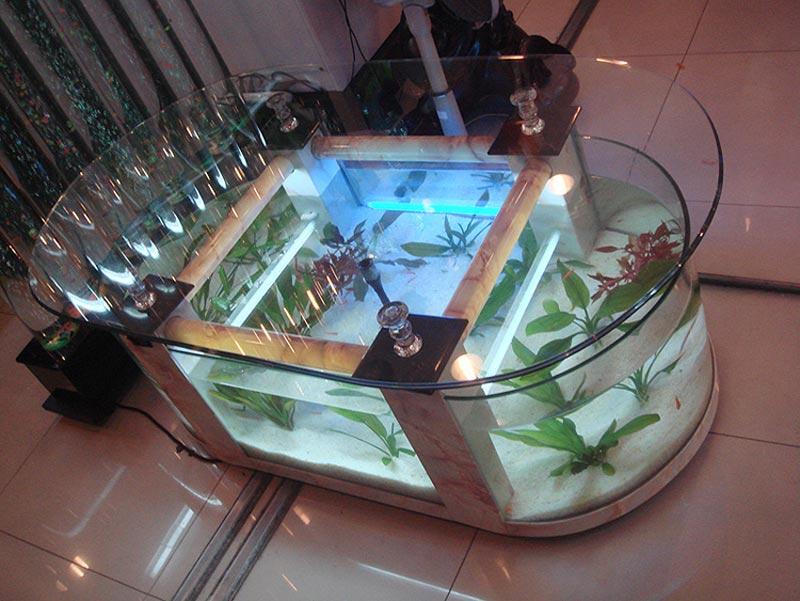
Locate an element on the screen. This screenshot has height=601, width=800. grey floor runner is located at coordinates (770, 284), (253, 499).